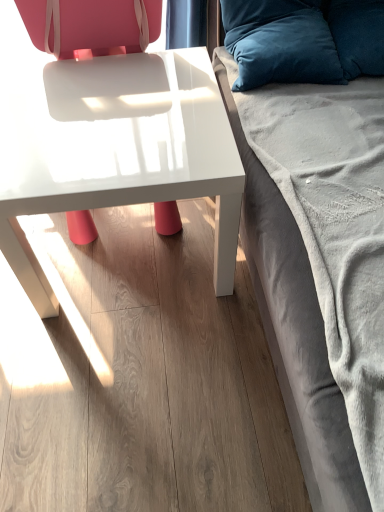
Find the location of a particular element. velvety blue pillow at upper right, acting as the 1th pillow starting from the right is located at coordinates (358, 36).

What is the approximate height of velvet gray studio couch at right?

velvet gray studio couch at right is 26.09 inches in height.

Image resolution: width=384 pixels, height=512 pixels. Find the location of `velvety blue pillow at upper right, the 2th pillow when ordered from left to right`. velvety blue pillow at upper right, the 2th pillow when ordered from left to right is located at coordinates (358, 36).

From the image's perspective, is white glossy table at center beneath matte white chair at center?

Indeed, from the image's perspective, white glossy table at center is shown beneath matte white chair at center.

Is white glossy table at center positioned beyond the bounds of matte white chair at center?

No, white glossy table at center is inside or overlapping with matte white chair at center.

Is white glossy table at center closer to camera compared to matte white chair at center?

No, it is behind matte white chair at center.

How many degrees apart are the facing directions of white glossy table at center and matte white chair at center?

There is a 4.71e-05-degree angle between the facing directions of white glossy table at center and matte white chair at center.

Where is `the 2nd pillow counting from the right side of the matte white chair at center`? The image size is (384, 512). the 2nd pillow counting from the right side of the matte white chair at center is located at coordinates (358, 36).

Can you tell me how much matte white chair at center and velvety blue pillow at upper right, acting as the 1th pillow starting from the right, differ in facing direction?

7.33 degrees separate the facing orientations of matte white chair at center and velvety blue pillow at upper right, acting as the 1th pillow starting from the right.

Is matte white chair at center aimed at velvety blue pillow at upper right, the 2th pillow when ordered from left to right?

No, matte white chair at center is not aimed at velvety blue pillow at upper right, the 2th pillow when ordered from left to right.

Does matte white chair at center come in front of velvety blue pillow at upper right, the 2th pillow when ordered from left to right?

Yes.

Is white glossy table at center surrounded by matte white chair at center?

Absolutely, white glossy table at center is inside matte white chair at center.

Considering the relative positions of matte white chair at center and white glossy table at center in the image provided, is matte white chair at center in front of white glossy table at center?

Yes, it is.

Considering the positions of point (80, 50) and point (27, 69), is point (80, 50) closer or farther from the camera than point (27, 69)?

Point (80, 50) appears to be farther away from the viewer than point (27, 69).

Is matte white chair at center aimed at white glossy table at center?

Yes, matte white chair at center is oriented towards white glossy table at center.

Based on the photo, considering the relative sizes of velvet gray studio couch at right and matte white chair at center in the image provided, is velvet gray studio couch at right shorter than matte white chair at center?

Yes, velvet gray studio couch at right is shorter than matte white chair at center.

From the image's perspective, would you say velvet gray studio couch at right is positioned over matte white chair at center?

Incorrect, from the image's perspective, velvet gray studio couch at right is lower than matte white chair at center.

What's the angular difference between velvet gray studio couch at right and matte white chair at center's facing directions?

The angle between the facing direction of velvet gray studio couch at right and the facing direction of matte white chair at center is 90 degrees.

Find the location of `pillow below the velvety blue pillow at upper right, the 2th pillow when ordered from left to right (from the image's perspective)`. pillow below the velvety blue pillow at upper right, the 2th pillow when ordered from left to right (from the image's perspective) is located at coordinates (279, 42).

In the scene shown: From a real-world perspective, is velvety blue pillow at upper right, which is the 2th pillow from right to left, on velvety blue pillow at upper right, acting as the 1th pillow starting from the right?

Actually, velvety blue pillow at upper right, which is the 2th pillow from right to left, is physically below velvety blue pillow at upper right, acting as the 1th pillow starting from the right, in the real world.

Is velvety blue pillow at upper right, the first pillow positioned from the left, taller than velvety blue pillow at upper right, acting as the 1th pillow starting from the right?

Yes.

Does matte white chair at center turn towards velvety blue pillow at upper right, which is the 2th pillow from right to left?

No, matte white chair at center is not oriented towards velvety blue pillow at upper right, which is the 2th pillow from right to left.

Considering their positions, is matte white chair at center located in front of or behind velvety blue pillow at upper right, the first pillow positioned from the left?

In the image, matte white chair at center appears in front of velvety blue pillow at upper right, the first pillow positioned from the left.

From the image's perspective, which is above, matte white chair at center or velvety blue pillow at upper right, the first pillow positioned from the left?

velvety blue pillow at upper right, the first pillow positioned from the left, is shown above in the image.

Considering the relative sizes of matte white chair at center and velvety blue pillow at upper right, which is the 2th pillow from right to left, in the image provided, is matte white chair at center shorter than velvety blue pillow at upper right, which is the 2th pillow from right to left,?

Incorrect, the height of matte white chair at center does not fall short of that of velvety blue pillow at upper right, which is the 2th pillow from right to left.

Would you say velvety blue pillow at upper right, the first pillow positioned from the left, contains white glossy table at center?

Definitely not — white glossy table at center is not inside velvety blue pillow at upper right, the first pillow positioned from the left.

From the image's perspective, between velvety blue pillow at upper right, which is the 2th pillow from right to left, and white glossy table at center, who is located below?

From the image's view, white glossy table at center is below.

Does velvety blue pillow at upper right, which is the 2th pillow from right to left, have a greater width compared to white glossy table at center?

Incorrect, the width of velvety blue pillow at upper right, which is the 2th pillow from right to left, does not surpass that of white glossy table at center.

Between velvety blue pillow at upper right, the first pillow positioned from the left, and white glossy table at center, which one appears on the left side from the viewer's perspective?

white glossy table at center.

The image size is (384, 512). I want to click on table below the matte white chair at center (from a real-world perspective), so (114, 147).

The width and height of the screenshot is (384, 512). I want to click on the 2nd pillow located above the matte white chair at center (from a real-world perspective), so click(358, 36).

From the image, which object appears to be farther from white glossy table at center, velvet gray studio couch at right or velvety blue pillow at upper right, the 2th pillow when ordered from left to right?

Based on the image, velvety blue pillow at upper right, the 2th pillow when ordered from left to right, appears to be further to white glossy table at center.

In the scene shown: From the image, which object appears to be nearer to velvet gray studio couch at right, matte white chair at center or velvety blue pillow at upper right, which is the 2th pillow from right to left?

velvety blue pillow at upper right, which is the 2th pillow from right to left.

Estimate the real-world distances between objects in this image. Which object is further from matte white chair at center, velvet gray studio couch at right or white glossy table at center?

velvet gray studio couch at right is further to matte white chair at center.

From the image, which object appears to be nearer to white glossy table at center, velvety blue pillow at upper right, the first pillow positioned from the left, or matte white chair at center?

Among the two, velvety blue pillow at upper right, the first pillow positioned from the left, is located nearer to white glossy table at center.

Consider the image. When comparing their distances from matte white chair at center, does velvety blue pillow at upper right, the 2th pillow when ordered from left to right, or velvet gray studio couch at right seem closer?

Among the two, velvety blue pillow at upper right, the 2th pillow when ordered from left to right, is located nearer to matte white chair at center.

Considering their positions, is white glossy table at center positioned closer to matte white chair at center than velvet gray studio couch at right?

Based on the image, white glossy table at center appears to be nearer to matte white chair at center.

When comparing their distances from velvety blue pillow at upper right, the first pillow positioned from the left, does velvet gray studio couch at right or velvety blue pillow at upper right, acting as the 1th pillow starting from the right, seem closer?

Based on the image, velvety blue pillow at upper right, acting as the 1th pillow starting from the right, appears to be nearer to velvety blue pillow at upper right, the first pillow positioned from the left.

Looking at the image, which one is located further to matte white chair at center, white glossy table at center or velvety blue pillow at upper right, the first pillow positioned from the left?

velvety blue pillow at upper right, the first pillow positioned from the left, lies further to matte white chair at center than the other object.

This screenshot has width=384, height=512. I want to click on chair between velvet gray studio couch at right and white glossy table at center from front to back, so coord(91,26).

This screenshot has width=384, height=512. Find the location of `table situated between matte white chair at center and velvety blue pillow at upper right, which is the 2th pillow from right to left, from left to right`. table situated between matte white chair at center and velvety blue pillow at upper right, which is the 2th pillow from right to left, from left to right is located at coordinates (x=114, y=147).

Locate an element on the screen. The width and height of the screenshot is (384, 512). table between matte white chair at center and velvety blue pillow at upper right, acting as the 1th pillow starting from the right, in the horizontal direction is located at coordinates (114, 147).

The width and height of the screenshot is (384, 512). I want to click on chair located between velvet gray studio couch at right and velvety blue pillow at upper right, the first pillow positioned from the left, in the depth direction, so click(91, 26).